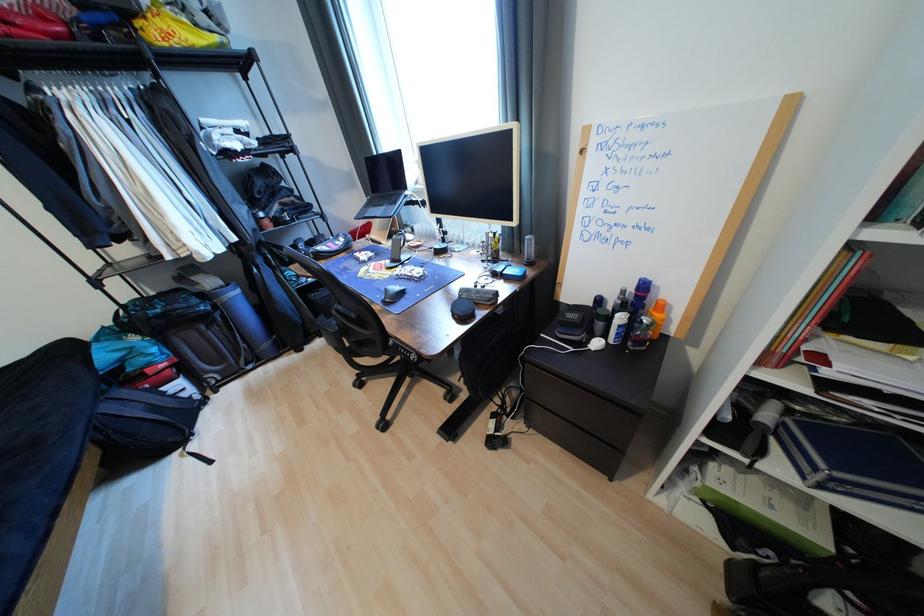
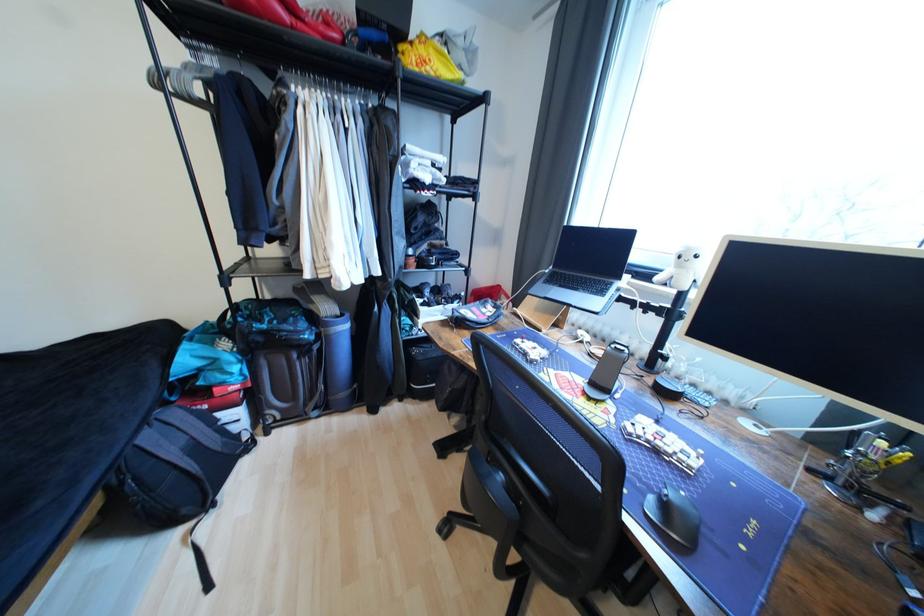
Where in the second image is the point corresponding to point (116, 408) from the first image?

(155, 439)